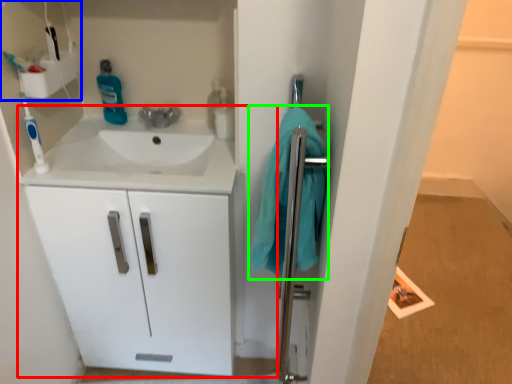
Question: Based on their relative distances, which object is farther from bathroom cabinet (highlighted by a red box)? Choose from shelf (highlighted by a blue box) and bath towel (highlighted by a green box).

Choices:
 (A) shelf
 (B) bath towel

Answer: (A)